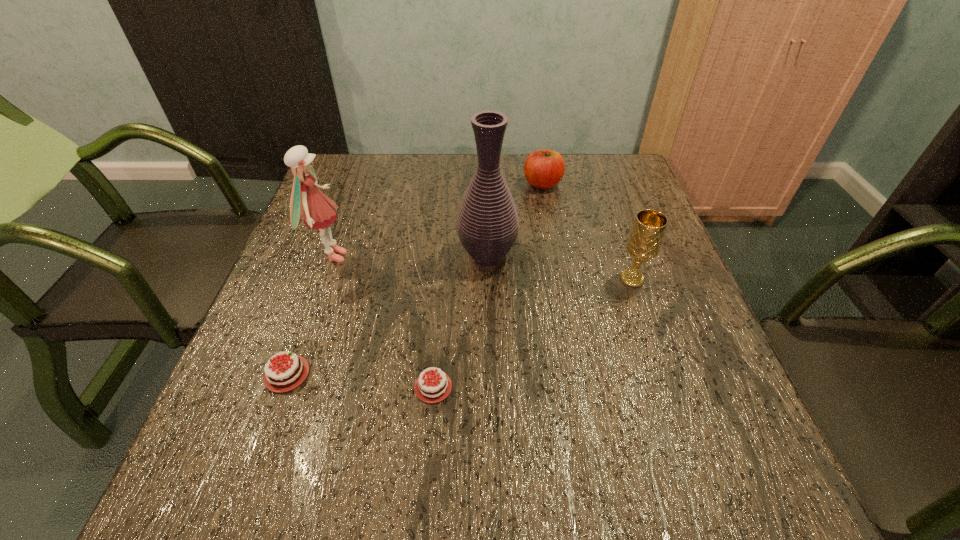
Locate an element on the screen. The width and height of the screenshot is (960, 540). vacant point located 0.330m on the back of the taller chocolate cake is located at coordinates (338, 232).

In order to click on vacant space located 0.290m on the left of the shorter chocolate cake in this screenshot , I will do `click(228, 387)`.

I want to click on free location located 0.060m on the back of the third shortest object, so coord(539,163).

I want to click on blank area located on the front of the rightmost object, so click(647, 322).

The height and width of the screenshot is (540, 960). I want to click on vacant area situated on the back of the tallest object, so click(x=486, y=154).

Identify the location of free space located on the front-facing side of the fifth shortest object. (371, 256).

Find the location of a particular element. Image resolution: width=960 pixels, height=540 pixels. object located in the far edge section of the desktop is located at coordinates (543, 169).

Locate an element on the screen. The height and width of the screenshot is (540, 960). chocolate cake situated at the left edge is located at coordinates (282, 376).

Locate an element on the screen. doll located at the left edge is located at coordinates (316, 209).

Where is `object at the right edge`? The height and width of the screenshot is (540, 960). object at the right edge is located at coordinates (644, 242).